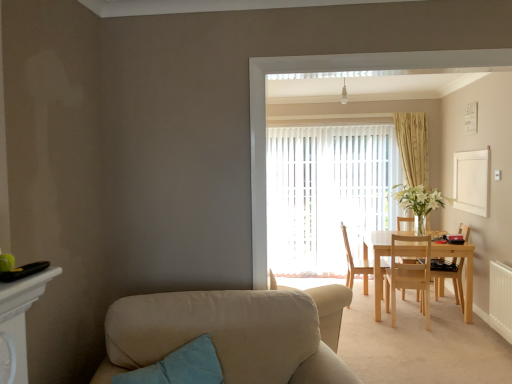
Question: In terms of size, does light wood chair at center, the 3th chair when ordered from right to left, appear bigger or smaller than teal fabric pillow at lower left?

Choices:
 (A) small
 (B) big

Answer: (B)

Question: Considering the positions of light wood chair at center, which ranks as the first chair in left-to-right order, and teal fabric pillow at lower left in the image, is light wood chair at center, which ranks as the first chair in left-to-right order, wider or thinner than teal fabric pillow at lower left?

Choices:
 (A) thin
 (B) wide

Answer: (B)

Question: Estimate the real-world distances between objects in this image. Which object is farther from the teal fabric pillow at lower left?

Choices:
 (A) beige fabric couch at lower left
 (B) teal fabric pillow at lower left
 (C) light wood chair at right, the 1th chair in the right-to-left sequence
 (D) light wood table at center
 (E) white textured radiator at lower right

Answer: (C)

Question: Which object is the closest to the light wood chair at center, which ranks as the first chair in left-to-right order?

Choices:
 (A) white textured radiator at lower right
 (B) white vertical blinds at center
 (C) beige textured curtain at center
 (D) teal fabric pillow at lower left
 (E) teal fabric pillow at lower left

Answer: (B)